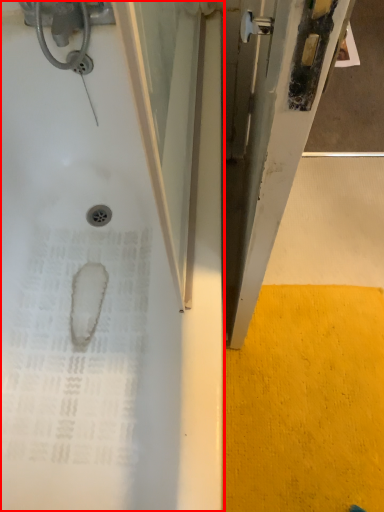
Question: Where is bathtub (annotated by the red box) located in relation to concrete in the image?

Choices:
 (A) left
 (B) right

Answer: (A)